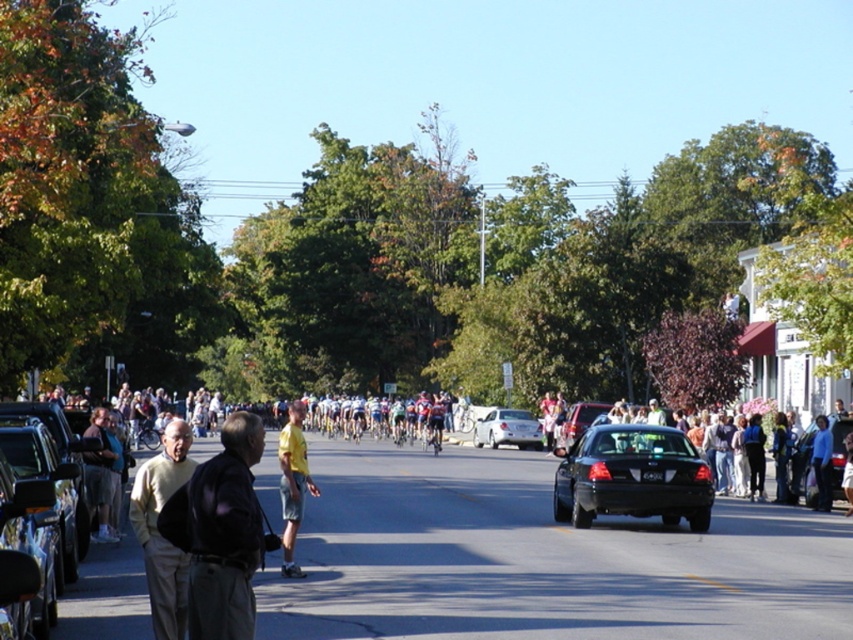
You are a cyclist participating in the event and currently positioned at point (291, 465). You need to reach point (657, 492) to pick up a water bottle. Which direction should you move in relative to your current position to reach the water bottle?

You should move forward towards point (657, 492) because it is closer to you than point (291, 465).

You are a photographer standing at the edge of the street during the cycling event. You want to take a photo of the light beige sweater at center. Where should you aim your camera to capture it?

You should aim your camera at point 0.834 on the horizontal axis and 0.188 on the vertical axis to capture the light beige sweater at center.

You are a participant in the cycling event and need to navigate around the black glossy sedan at right. What is the exact 2D coordinate of the sedan to ensure safe passage?

The black glossy sedan at right is located at the 2D coordinate point of (x=804, y=468).